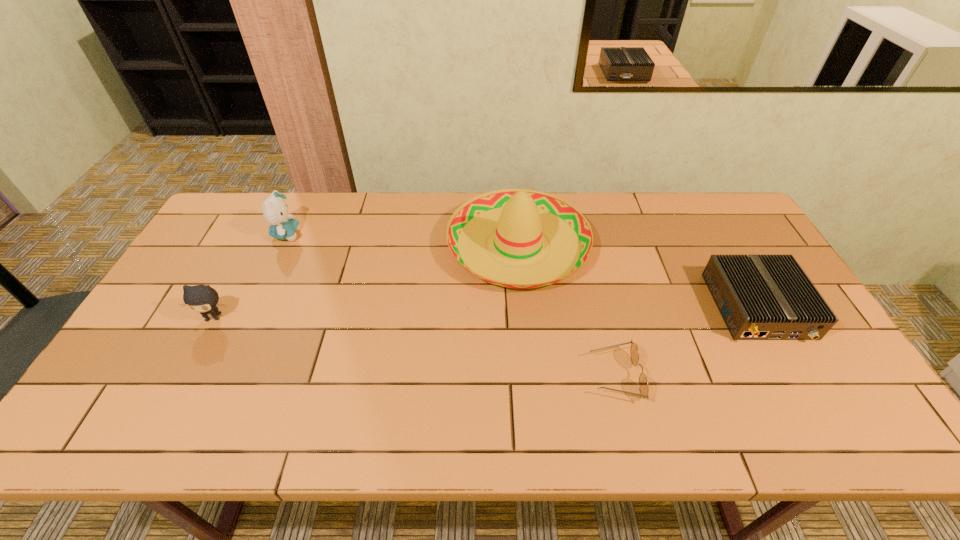
Find the location of `free space located 0.400m on the face of the farther kitten`. free space located 0.400m on the face of the farther kitten is located at coordinates (422, 234).

I want to click on free region located on the front-facing side of the nearer kitten, so click(x=149, y=438).

Locate an element on the screen. The height and width of the screenshot is (540, 960). blank space located 0.190m on the back panel of the rightmost object is located at coordinates (820, 415).

Where is `free location located 0.320m on the front-facing side of the shortest object`? free location located 0.320m on the front-facing side of the shortest object is located at coordinates (461, 376).

Locate an element on the screen. vacant space positioned 0.120m on the front-facing side of the shortest object is located at coordinates (542, 376).

Identify the location of free space located on the front-facing side of the shortest object. (547, 376).

Identify the location of sombrero that is positioned at the far edge. This screenshot has width=960, height=540. (520, 216).

Find the location of a particular element. kitten at the far edge is located at coordinates (275, 210).

The image size is (960, 540). What are the coordinates of `object positioned at the near edge` in the screenshot? It's located at (634, 353).

Where is `object located at the left edge`? object located at the left edge is located at coordinates (201, 298).